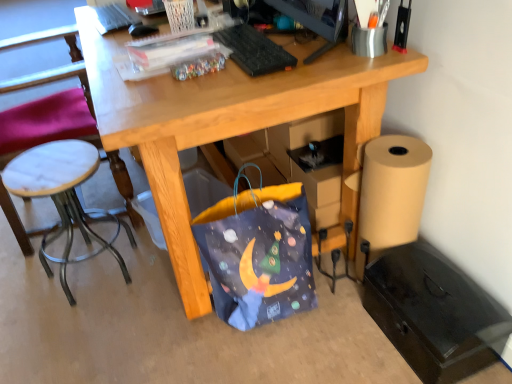
At what (x,y) coordinates should I click in order to perform the action: click on vacant space situated on the left part of blue fabric bag at lower center. Please return your answer as a coordinate pair (x, y). Looking at the image, I should click on (155, 323).